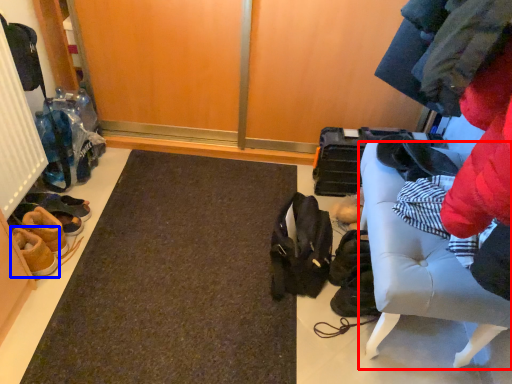
Question: Which point is further to the camera, furniture (highlighted by a red box) or footwear (highlighted by a blue box)?

Choices:
 (A) furniture
 (B) footwear

Answer: (B)